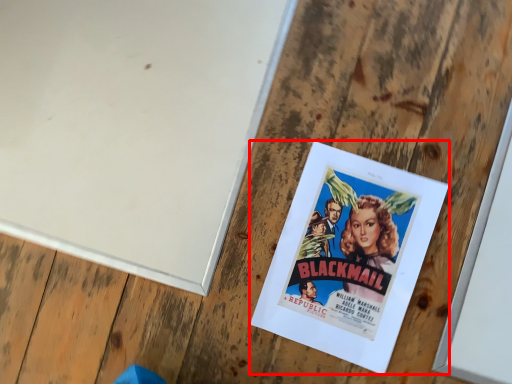
Question: In this image, where is poster (annotated by the red box) located relative to bulletin board?

Choices:
 (A) left
 (B) right

Answer: (B)